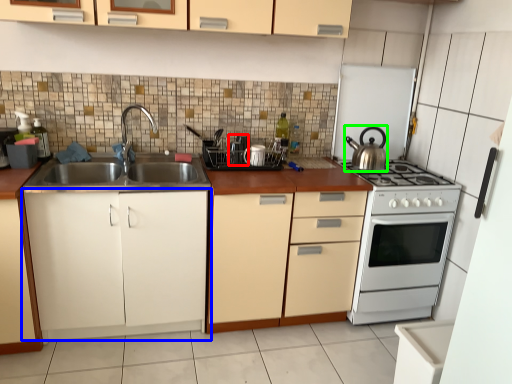
Question: Considering the real-world distances, which object is closest to appliance (highlighted by a red box)? cabinetry (highlighted by a blue box) or kitchen appliance (highlighted by a green box).

Choices:
 (A) cabinetry
 (B) kitchen appliance

Answer: (A)